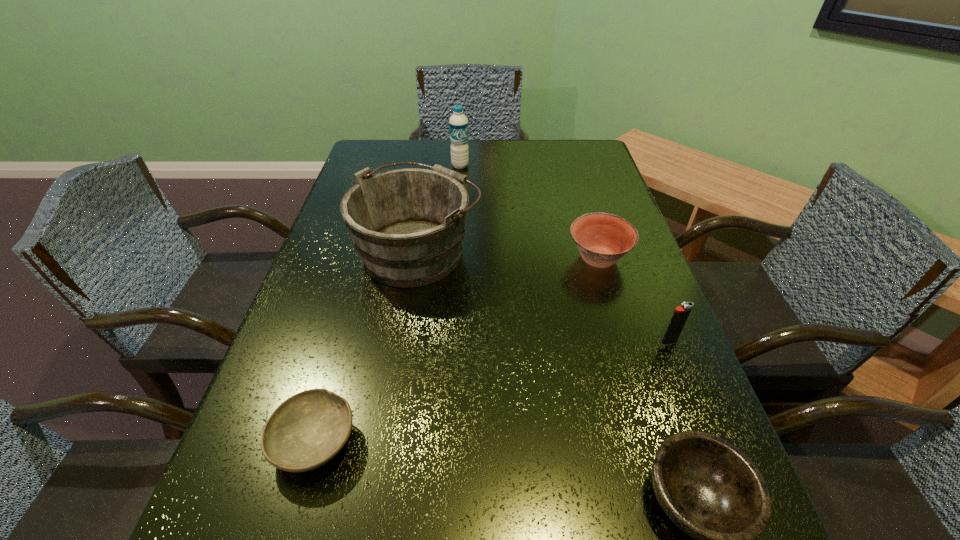
Find the location of a particular element. the farthest object is located at coordinates (458, 123).

You are a GUI agent. You are given a task and a screenshot of the screen. Output one action in this format:
    pyautogui.click(x=<x>, y=<y>)
    Task: Click on the wine bucket
    The height and width of the screenshot is (540, 960).
    Given the screenshot: What is the action you would take?
    pyautogui.click(x=407, y=225)

Locate an element on the screen. This screenshot has height=540, width=960. igniter is located at coordinates (681, 313).

Find the location of a particular element. the fourth shortest object is located at coordinates (681, 313).

Locate an element on the screen. The height and width of the screenshot is (540, 960). the farthest bowl is located at coordinates (602, 239).

Identify the location of the tallest bowl. click(x=602, y=239).

Find the location of a particular element. The image size is (960, 540). the shortest bowl is located at coordinates (306, 431).

I want to click on the leftmost bowl, so click(x=306, y=431).

This screenshot has height=540, width=960. Identify the location of vacant space located on the label of the water bottle. (457, 220).

Identify the location of vacant space located on the front of the wine bucket. (383, 473).